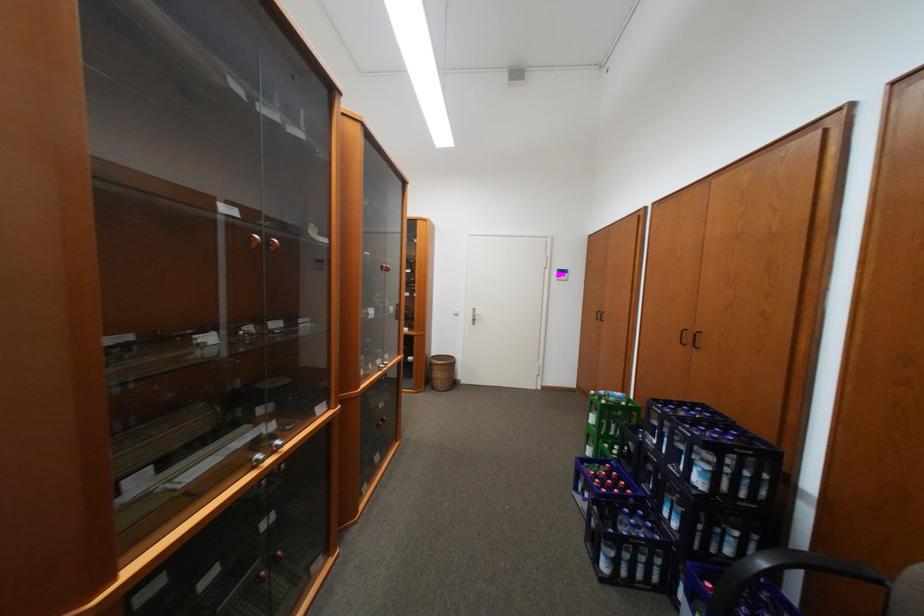
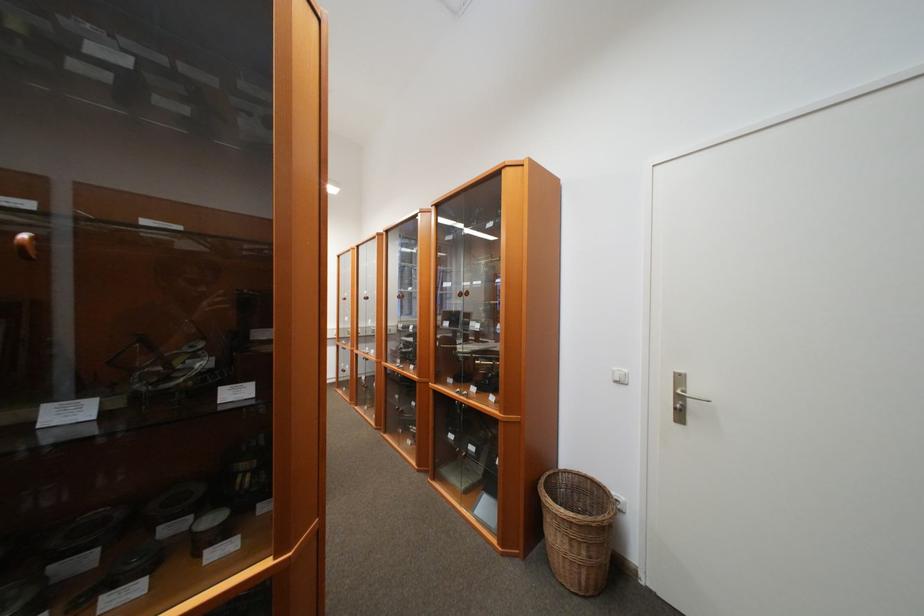
Find the pixel in the second image that matches (x=445, y=362) in the first image.

(560, 501)